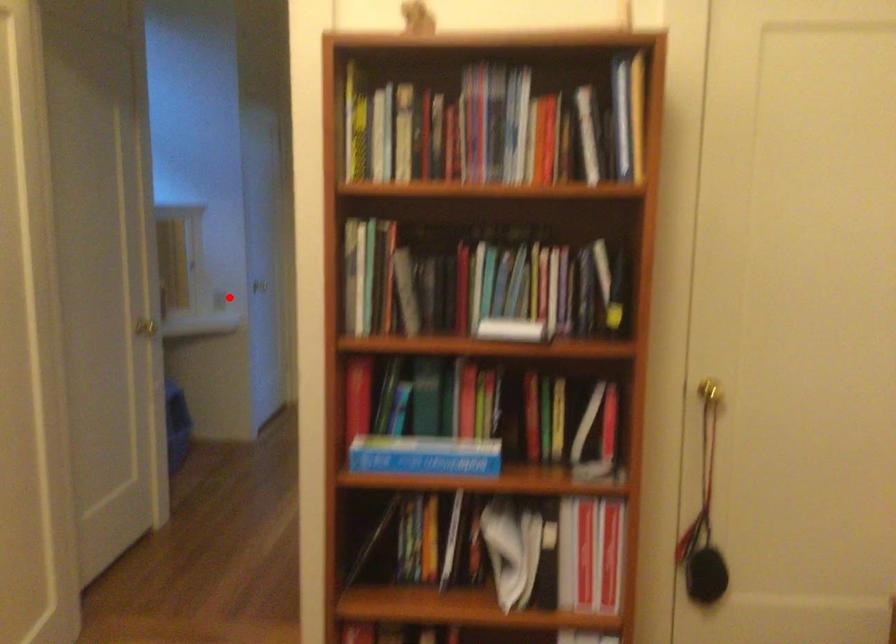
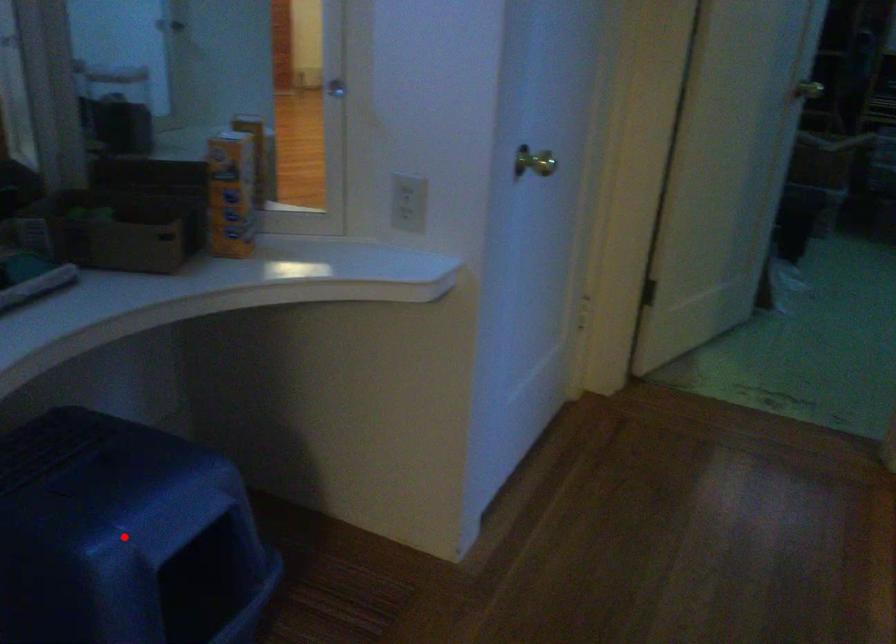
I am providing you with two images of the same scene from different viewpoints. A red point is marked on the first image and another point is marked on the second image. Do the highlighted points in image1 and image2 indicate the same real-world spot?

No